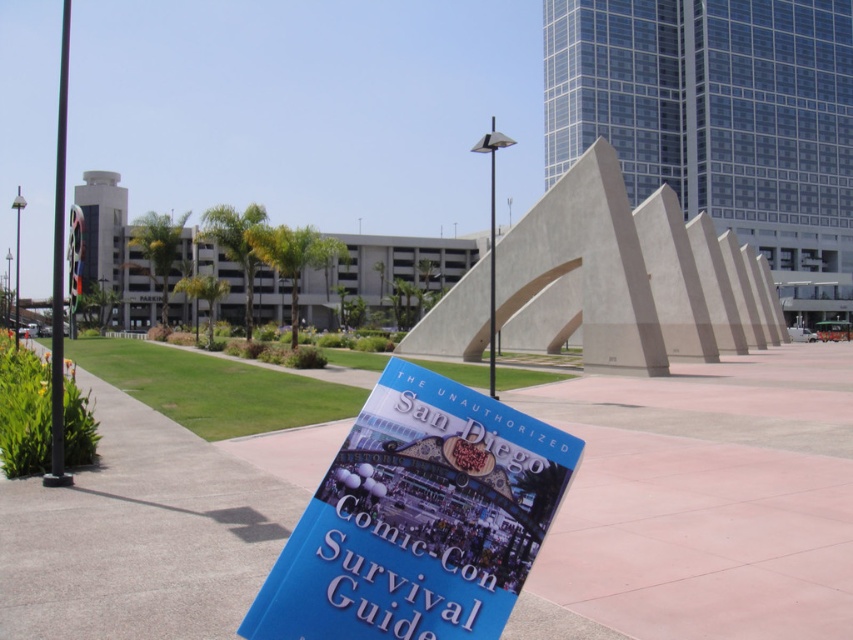
Is blue paper book at center positioned behind metallic pole at center?

No, blue paper book at center is closer to the viewer.

Is blue paper book at center to the right of metallic pole at center from the viewer's perspective?

Incorrect, blue paper book at center is not on the right side of metallic pole at center.

The height and width of the screenshot is (640, 853). What do you see at coordinates (418, 518) in the screenshot?
I see `blue paper book at center` at bounding box center [418, 518].

What are the coordinates of `blue paper book at center` in the screenshot? It's located at (418, 518).

Can you confirm if black metal pole at left is positioned above metallic pole at center?

Indeed, black metal pole at left is positioned over metallic pole at center.

Can you confirm if black metal pole at left is thinner than metallic pole at center?

No, black metal pole at left is not thinner than metallic pole at center.

This screenshot has width=853, height=640. Find the location of `black metal pole at left`. black metal pole at left is located at coordinates (57, 273).

Which is behind, point (291, 592) or point (65, 52)?

The point (65, 52) is more distant.

Can you confirm if blue paper book at center is bigger than black metal pole at left?

Incorrect, blue paper book at center is not larger than black metal pole at left.

I want to click on blue paper book at center, so click(418, 518).

Where is `blue paper book at center`? This screenshot has height=640, width=853. blue paper book at center is located at coordinates (418, 518).